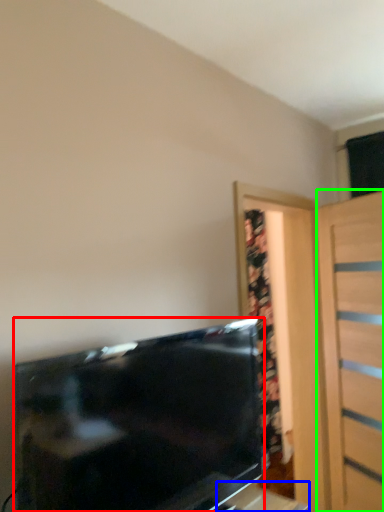
Question: Considering the real-world distances, which object is closest to television (highlighted by a red box)? table (highlighted by a blue box) or door (highlighted by a green box).

Choices:
 (A) table
 (B) door

Answer: (B)